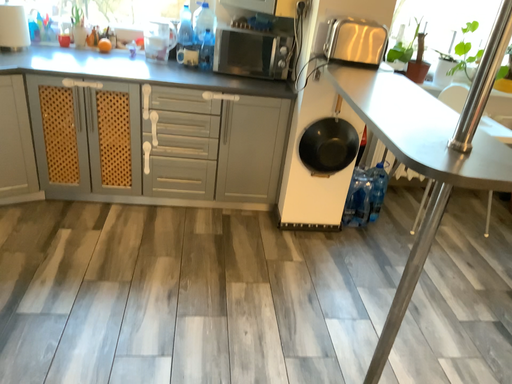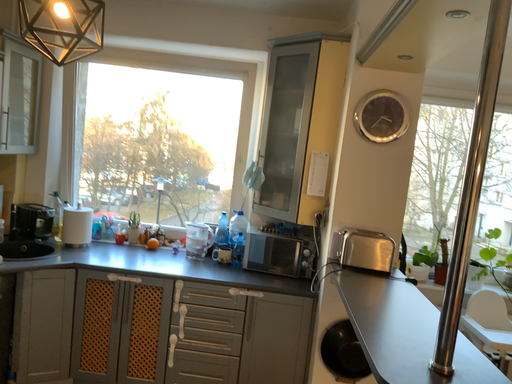
Question: Which way did the camera rotate in the video?

Choices:
 (A) rotated downward
 (B) rotated upward

Answer: (B)